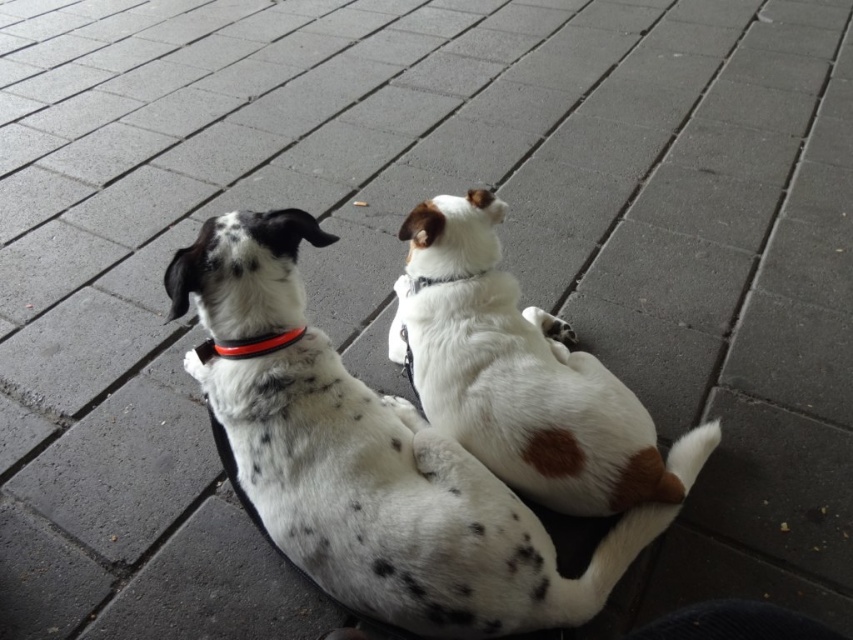
Question: Which is farther from the white fur dog at center?

Choices:
 (A) black rubber neckband at upper left
 (B) white fabric neckband at upper center

Answer: (A)

Question: Which of the following is the farthest from the observer?

Choices:
 (A) white fabric neckband at upper center
 (B) white fur dog at center
 (C) spotted fur dog at center
 (D) black rubber neckband at upper left

Answer: (A)

Question: Is black rubber neckband at upper left smaller than white fabric neckband at upper center?

Choices:
 (A) yes
 (B) no

Answer: (A)

Question: Is spotted fur dog at center to the right of black rubber neckband at upper left from the viewer's perspective?

Choices:
 (A) no
 (B) yes

Answer: (B)

Question: Which object is closer to the camera taking this photo?

Choices:
 (A) black rubber neckband at upper left
 (B) white fabric neckband at upper center
 (C) white fur dog at center
 (D) spotted fur dog at center

Answer: (D)

Question: Is spotted fur dog at center in front of black rubber neckband at upper left?

Choices:
 (A) no
 (B) yes

Answer: (B)